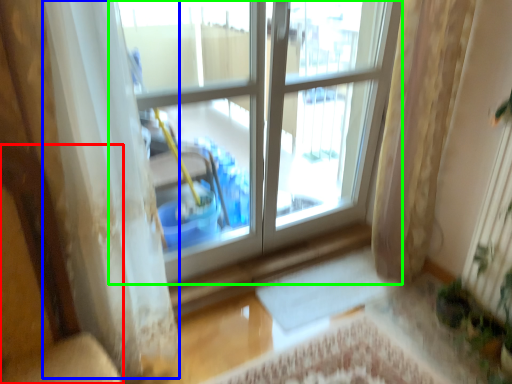
Question: Which object is positioned farthest from armchair (highlighted by a red box)? Select from curtain (highlighted by a blue box) and window (highlighted by a green box).

Choices:
 (A) curtain
 (B) window

Answer: (B)